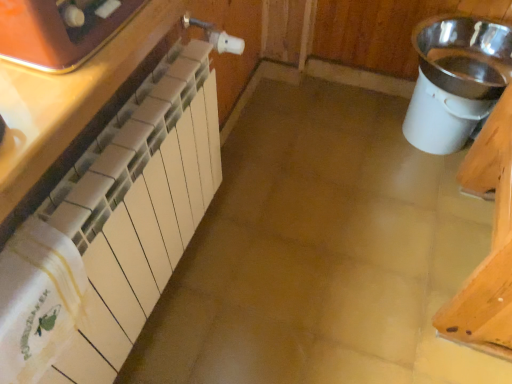
Where is `free region under matte white radiator at left, the second cabinetry positioned from the front (from a real-world perspective)`? free region under matte white radiator at left, the second cabinetry positioned from the front (from a real-world perspective) is located at coordinates (167, 309).